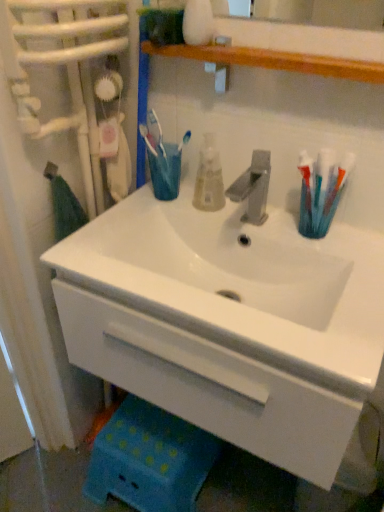
Locate an element on the screen. This screenshot has width=384, height=512. translucent plastic toothbrushes at right is located at coordinates (335, 193).

Identify the location of white glossy sink at center. (234, 327).

The height and width of the screenshot is (512, 384). What are the coordinates of `translucent plastic mouthwash at center` in the screenshot? It's located at (209, 177).

Looking at this image, from a real-world perspective, is translucent plastic cup at center positioned over translucent plastic toothbrushes at right based on gravity?

No.

Which of these two, translucent plastic cup at center or translucent plastic toothbrushes at right, is wider?

With larger width is translucent plastic cup at center.

Where is `toothbrush on the right of translucent plastic cup at center`? toothbrush on the right of translucent plastic cup at center is located at coordinates (335, 193).

Consider the image. Which object is closer to the camera, translucent plastic cup at center or translucent plastic toothbrushes at right?

translucent plastic toothbrushes at right is in front.

Considering the points (91, 263) and (212, 149), which point is behind, point (91, 263) or point (212, 149)?

The point (212, 149) is farther.

Based on their sizes in the image, would you say white glossy sink at center is bigger or smaller than translucent plastic mouthwash at center?

Clearly, white glossy sink at center is larger in size than translucent plastic mouthwash at center.

Is white glossy sink at center next to translucent plastic mouthwash at center?

white glossy sink at center and translucent plastic mouthwash at center are not in contact.

In the image, there is a translucent plastic mouthwash at center. Identify the location of turquoise below it (from a real-world perspective). This screenshot has height=512, width=384. (165, 170).

From the image's perspective, does translucent plastic mouthwash at center appear lower than translucent plastic cup at center?

Correct, translucent plastic mouthwash at center appears lower than translucent plastic cup at center in the image.

From a real-world perspective, is translucent plastic mouthwash at center physically located above or below translucent plastic cup at center?

From a real-world perspective, translucent plastic mouthwash at center is physically above translucent plastic cup at center.

How many degrees apart are the facing directions of translucent plastic cup at center and translucent plastic mouthwash at center?

0.00231 degrees separate the facing orientations of translucent plastic cup at center and translucent plastic mouthwash at center.

Is point (156, 184) less distant than point (205, 150)?

No.

From the image's perspective, which object appears higher, translucent plastic cup at center or translucent plastic mouthwash at center?

From the image's view, translucent plastic cup at center is above.

Is translucent plastic mouthwash at center inside translucent plastic cup at center?

No, translucent plastic cup at center does not contain translucent plastic mouthwash at center.

Are translucent plastic toothbrushes at right and white glossy sink at center located far from each other?

No, there isn't a large distance between translucent plastic toothbrushes at right and white glossy sink at center.

Is translucent plastic toothbrushes at right aimed at white glossy sink at center?

No.

How far apart are translucent plastic toothbrushes at right and white glossy sink at center?

translucent plastic toothbrushes at right and white glossy sink at center are 12.51 inches apart.

Is translucent plastic toothbrushes at right inside or outside of white glossy sink at center?

translucent plastic toothbrushes at right is outside white glossy sink at center.

Considering the sizes of objects white glossy sink at center and translucent plastic toothbrushes at right in the image provided, who is shorter, white glossy sink at center or translucent plastic toothbrushes at right?

translucent plastic toothbrushes at right.

Is white glossy sink at center turned away from translucent plastic toothbrushes at right?

white glossy sink at center does not have its back to translucent plastic toothbrushes at right.

Which is less distant, (241,347) or (343,187)?

Point (241,347) appears to be closer to the viewer than point (343,187).

Considering the positions of points (163, 217) and (174, 170), is point (163, 217) farther from camera compared to point (174, 170)?

No, it is not.

Who is smaller, white glossy sink at center or translucent plastic cup at center?

Smaller between the two is translucent plastic cup at center.

Could you tell me if white glossy sink at center is facing translucent plastic cup at center?

No, white glossy sink at center does not turn towards translucent plastic cup at center.

Between white glossy sink at center and translucent plastic cup at center, which one has less height?

translucent plastic cup at center.

Where is `toothbrush above the translucent plastic cup at center (from a real-world perspective)`? toothbrush above the translucent plastic cup at center (from a real-world perspective) is located at coordinates (335, 193).

This screenshot has width=384, height=512. Identify the location of mouthwash that appears behind the white glossy sink at center. (209, 177).

From the picture: Which object lies further to the anchor point translucent plastic cup at center, translucent plastic toothbrushes at right or white glossy sink at center?

translucent plastic toothbrushes at right is further to translucent plastic cup at center.

Estimate the real-world distances between objects in this image. Which object is closer to white glossy sink at center, translucent plastic toothbrushes at right or translucent plastic mouthwash at center?

translucent plastic mouthwash at center lies closer to white glossy sink at center than the other object.

When comparing their distances from white glossy sink at center, does translucent plastic cup at center or translucent plastic mouthwash at center seem closer?

Among the two, translucent plastic mouthwash at center is located nearer to white glossy sink at center.

Estimate the real-world distances between objects in this image. Which object is further from white glossy sink at center, translucent plastic cup at center or translucent plastic toothbrushes at right?

Among the two, translucent plastic cup at center is located further to white glossy sink at center.

Estimate the real-world distances between objects in this image. Which object is further from white glossy sink at center, translucent plastic mouthwash at center or translucent plastic toothbrushes at right?

Among the two, translucent plastic toothbrushes at right is located further to white glossy sink at center.

Which object lies further to the anchor point translucent plastic toothbrushes at right, translucent plastic mouthwash at center or translucent plastic cup at center?

Based on the image, translucent plastic cup at center appears to be further to translucent plastic toothbrushes at right.

Based on their spatial positions, is translucent plastic toothbrushes at right or translucent plastic mouthwash at center closer to translucent plastic cup at center?

translucent plastic mouthwash at center is positioned closer to the anchor translucent plastic cup at center.

When comparing their distances from translucent plastic toothbrushes at right, does translucent plastic cup at center or white glossy sink at center seem closer?

white glossy sink at center.

Find the location of a particular element. Image resolution: width=384 pixels, height=512 pixels. toothbrush between translucent plastic mouthwash at center and white glossy sink at center vertically is located at coordinates (335, 193).

What are the coordinates of `mouthwash between white glossy sink at center and translucent plastic cup at center from front to back` in the screenshot? It's located at (209, 177).

Image resolution: width=384 pixels, height=512 pixels. In order to click on toothbrush between white glossy sink at center and translucent plastic cup at center from front to back in this screenshot , I will do `click(335, 193)`.

Image resolution: width=384 pixels, height=512 pixels. In order to click on mouthwash between translucent plastic cup at center and translucent plastic toothbrushes at right in the horizontal direction in this screenshot , I will do `click(209, 177)`.